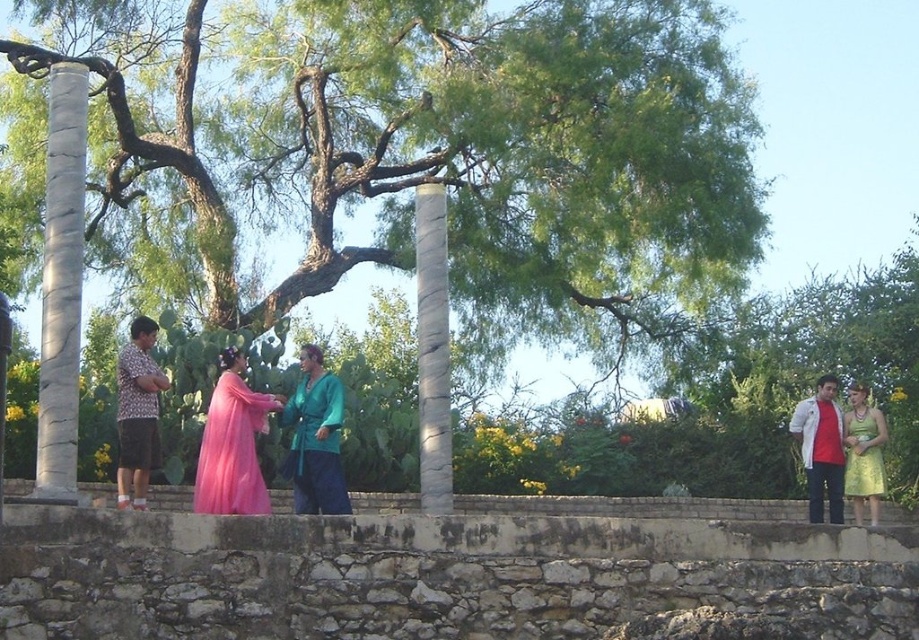
Does printed cotton shirt at left have a greater height compared to white cotton shirt at right?

Correct, printed cotton shirt at left is much taller as white cotton shirt at right.

Does point (143, 365) come in front of point (832, 444)?

Yes.

Image resolution: width=919 pixels, height=640 pixels. What are the coordinates of `printed cotton shirt at left` in the screenshot? It's located at (137, 412).

Describe the element at coordinates (432, 349) in the screenshot. The image size is (919, 640). I see `marble column at center` at that location.

Between point (437, 307) and point (304, 465), which one is positioned behind?

Point (437, 307)

Identify the location of marble column at center. This screenshot has width=919, height=640. (432, 349).

From the picture: Who is shorter, white cotton shirt at right or green satin dress at right?

With less height is white cotton shirt at right.

Who is higher up, white cotton shirt at right or green satin dress at right?

white cotton shirt at right is above.

Find the location of a particular element. white cotton shirt at right is located at coordinates (821, 449).